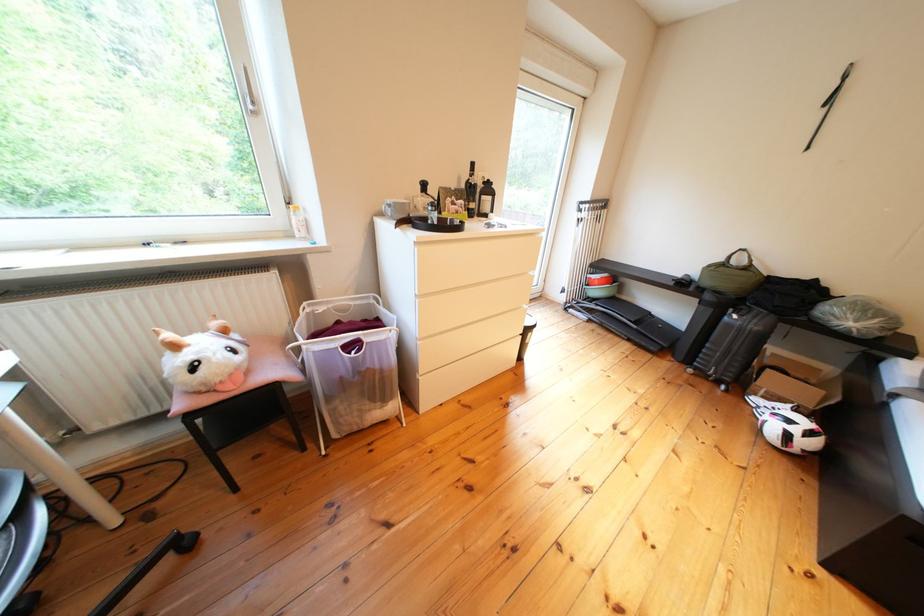
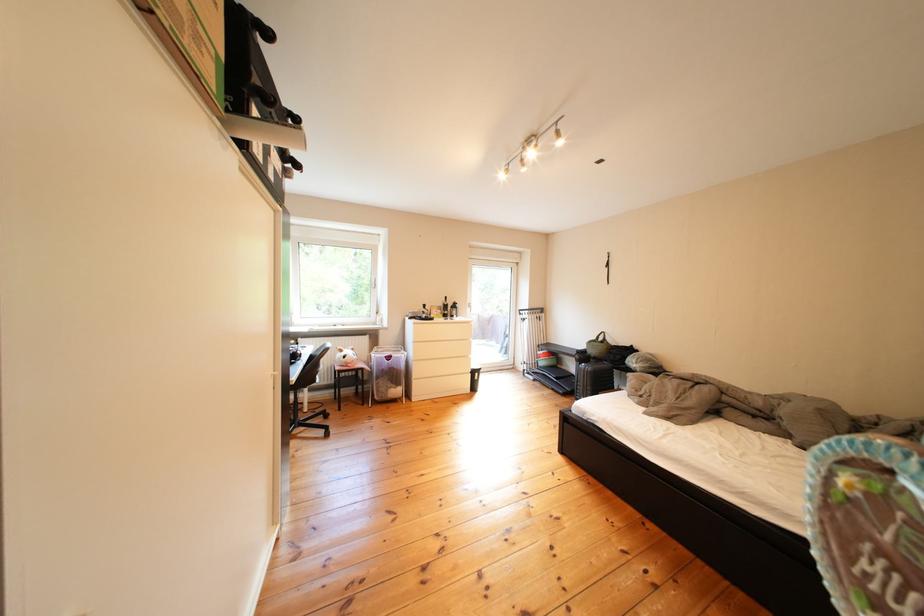
Locate, in the second image, the point that corresponds to [344,403] in the first image.

(392, 382)